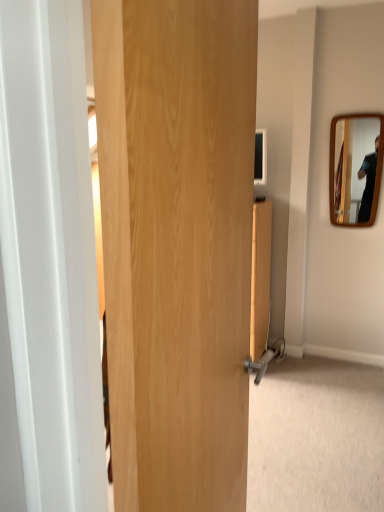
Question: Considering the relative positions of wooden door at center and wooden mirror at right in the image provided, is wooden door at center to the right of wooden mirror at right from the viewer's perspective?

Choices:
 (A) no
 (B) yes

Answer: (A)

Question: Can you confirm if wooden door at center is bigger than wooden mirror at right?

Choices:
 (A) no
 (B) yes

Answer: (B)

Question: From a real-world perspective, does wooden door at center stand above wooden mirror at right?

Choices:
 (A) yes
 (B) no

Answer: (B)

Question: Does wooden door at center appear on the left side of wooden mirror at right?

Choices:
 (A) yes
 (B) no

Answer: (A)

Question: From a real-world perspective, is wooden door at center beneath wooden mirror at right?

Choices:
 (A) yes
 (B) no

Answer: (A)

Question: Is wooden door at center positioned beyond the bounds of wooden mirror at right?

Choices:
 (A) no
 (B) yes

Answer: (B)

Question: Is there a large distance between wooden mirror at right and wooden door at center?

Choices:
 (A) yes
 (B) no

Answer: (A)

Question: Is wooden mirror at right aimed at wooden door at center?

Choices:
 (A) no
 (B) yes

Answer: (B)

Question: Is wooden mirror at right taller than wooden door at center?

Choices:
 (A) yes
 (B) no

Answer: (B)

Question: Does wooden mirror at right lie behind wooden door at center?

Choices:
 (A) yes
 (B) no

Answer: (A)

Question: Is wooden door at center located within wooden mirror at right?

Choices:
 (A) yes
 (B) no

Answer: (B)

Question: Can you confirm if wooden mirror at right is wider than wooden door at center?

Choices:
 (A) yes
 (B) no

Answer: (B)

Question: Is wooden mirror at right situated inside wooden door at center or outside?

Choices:
 (A) outside
 (B) inside

Answer: (A)